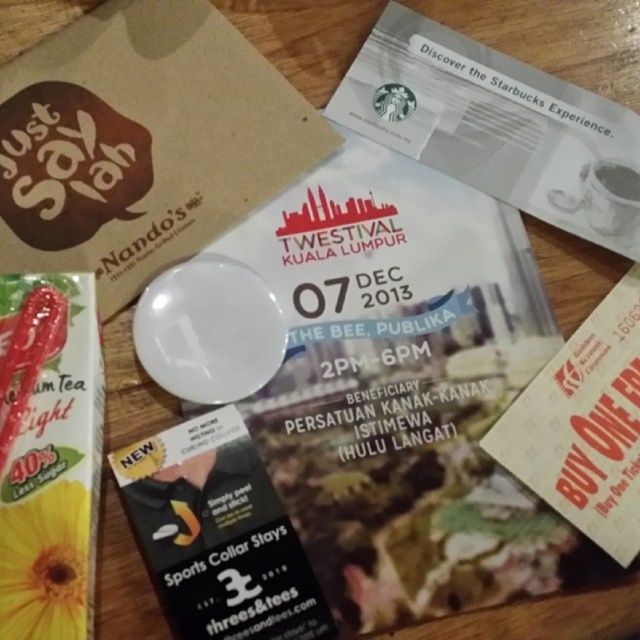
Is yellow paper at lower left to the right of black matte sports collar stays at center from the viewer's perspective?

Incorrect, yellow paper at lower left is not on the right side of black matte sports collar stays at center.

Does yellow paper at lower left have a lesser height compared to black matte sports collar stays at center?

In fact, yellow paper at lower left may be taller than black matte sports collar stays at center.

Between point (36, 426) and point (244, 483), which one is positioned in front?

Point (36, 426) is more forward.

In order to click on yellow paper at lower left in this screenshot , I will do `click(49, 452)`.

Does point (218, 426) lie behind point (593, 170)?

No, it is in front of (593, 170).

Between black matte sports collar stays at center and white ceramic mug at upper right, which one appears on the right side from the viewer's perspective?

From the viewer's perspective, white ceramic mug at upper right appears more on the right side.

Is point (192, 481) farther from camera compared to point (608, 164)?

No, it is not.

You are a GUI agent. You are given a task and a screenshot of the screen. Output one action in this format:
    pyautogui.click(x=<x>, y=<y>)
    Task: Click on the black matte sports collar stays at center
    This screenshot has height=640, width=640.
    Given the screenshot: What is the action you would take?
    click(x=218, y=534)

Is white paper at upper center to the right of black matte sports collar stays at center from the viewer's perspective?

Indeed, white paper at upper center is positioned on the right side of black matte sports collar stays at center.

Locate an element on the screen. The image size is (640, 640). white paper at upper center is located at coordinates (497, 125).

At what (x,y) coordinates should I click in order to perform the action: click on white paper at upper center. Please return your answer as a coordinate pair (x, y). Looking at the image, I should click on (497, 125).